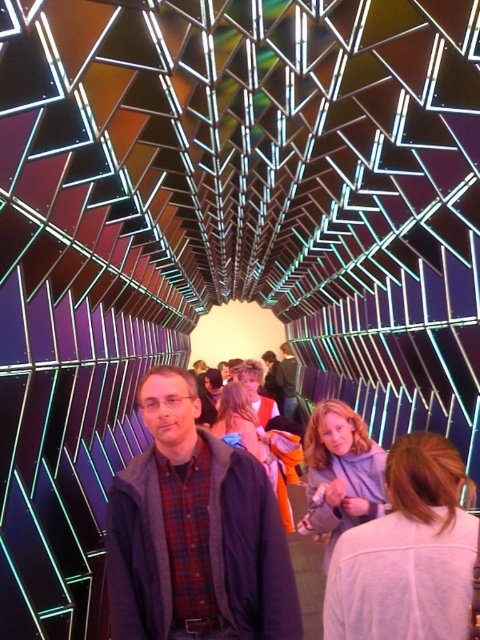
Is plaid shirt at center to the right of matte black jacket at center from the viewer's perspective?

No, plaid shirt at center is not to the right of matte black jacket at center.

The image size is (480, 640). In order to click on plaid shirt at center in this screenshot , I will do `click(194, 532)`.